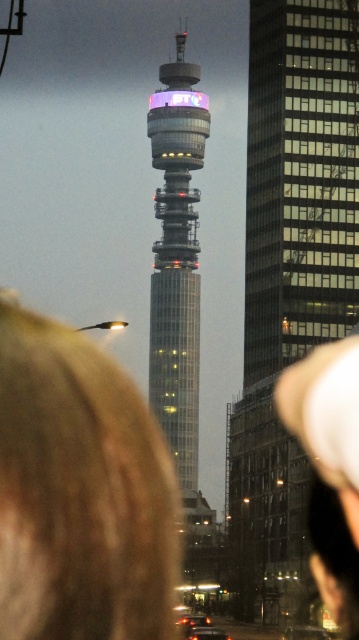
Question: Is blonde hair at lower left smaller than white fabric cap at upper right?

Choices:
 (A) yes
 (B) no

Answer: (A)

Question: Which object appears closest to the camera in this image?

Choices:
 (A) white fabric cap at upper right
 (B) blonde hair at lower left
 (C) glassy metallic tower at center

Answer: (B)

Question: Which of the following is the farthest from the observer?

Choices:
 (A) blonde hair at lower left
 (B) glassy steel tower at center
 (C) white fabric cap at upper right

Answer: (B)

Question: Is blonde hair at lower left thinner than white fabric cap at upper right?

Choices:
 (A) yes
 (B) no

Answer: (A)

Question: Is glassy steel tower at center wider than blonde hair at lower left?

Choices:
 (A) yes
 (B) no

Answer: (A)

Question: Which point is closer to the camera?

Choices:
 (A) (67, 593)
 (B) (178, 298)
 (C) (240, 496)

Answer: (A)